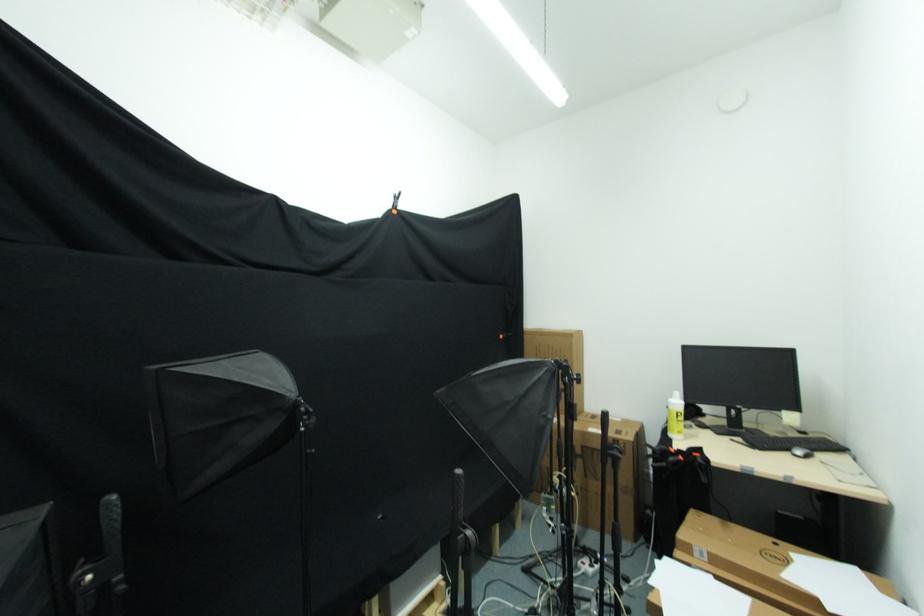
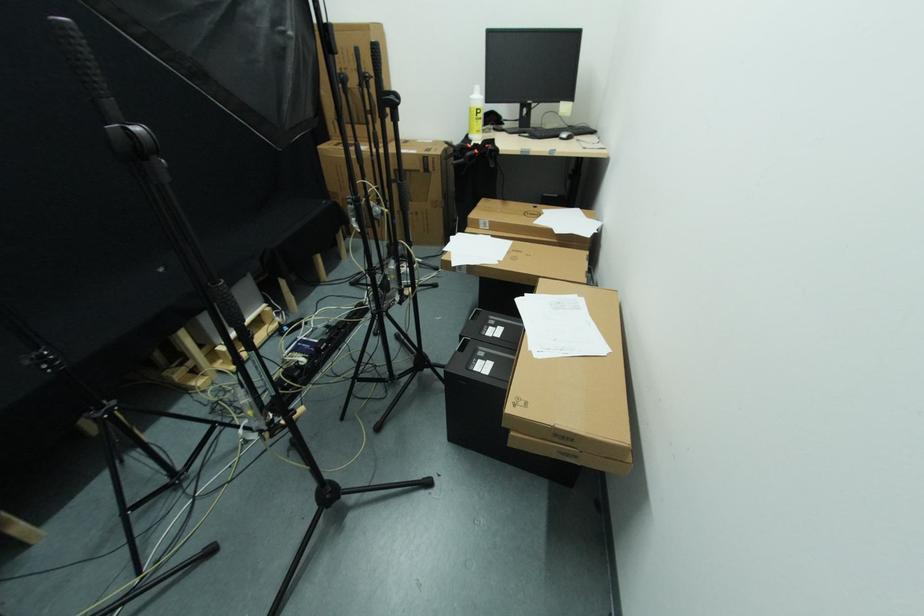
Where in the second image is the point corresponding to (623,446) from the first image?

(432, 161)